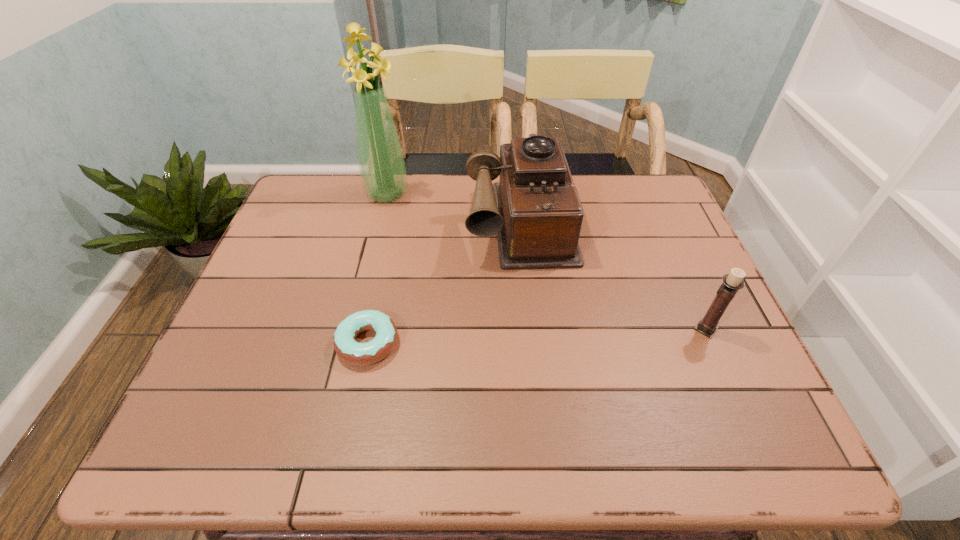
Locate an element on the screen. free region located on the front-facing side of the tallest object is located at coordinates (445, 266).

Where is `free point located 0.260m on the horn of the phonograph_record`? The image size is (960, 540). free point located 0.260m on the horn of the phonograph_record is located at coordinates (540, 354).

Identify the location of free location located on the horn of the phonograph_record. The height and width of the screenshot is (540, 960). (539, 347).

In order to click on free location located 0.050m on the horn of the phonograph_record in this screenshot , I will do `click(529, 284)`.

This screenshot has width=960, height=540. In order to click on bouquet that is positioned at the far edge in this screenshot , I will do `click(382, 167)`.

This screenshot has height=540, width=960. Identify the location of phonograph_record situated at the far edge. (535, 211).

You are a GUI agent. You are given a task and a screenshot of the screen. Output one action in this format:
    pyautogui.click(x=<x>, y=<y>)
    Task: Click on the object that is at the near edge
    This screenshot has height=540, width=960.
    Given the screenshot: What is the action you would take?
    tap(353, 352)

At what (x,y) coordinates should I click in order to perform the action: click on object situated at the right edge. Please return your answer as a coordinate pair (x, y). This screenshot has height=540, width=960. Looking at the image, I should click on 732,282.

Where is `free space at the far edge of the desktop`? The width and height of the screenshot is (960, 540). free space at the far edge of the desktop is located at coordinates (575, 178).

In the image, there is a desktop. Where is `vacant space at the near edge`? vacant space at the near edge is located at coordinates (285, 377).